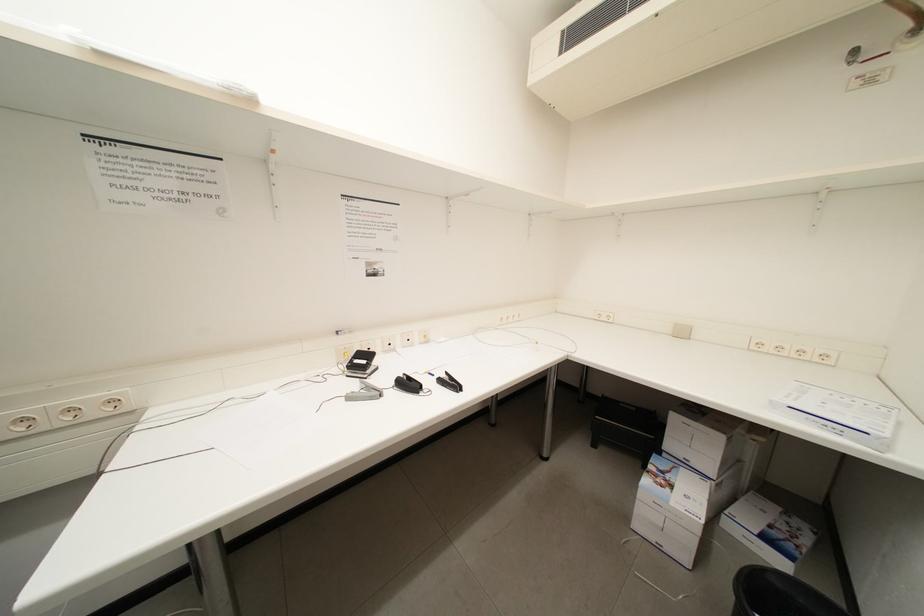
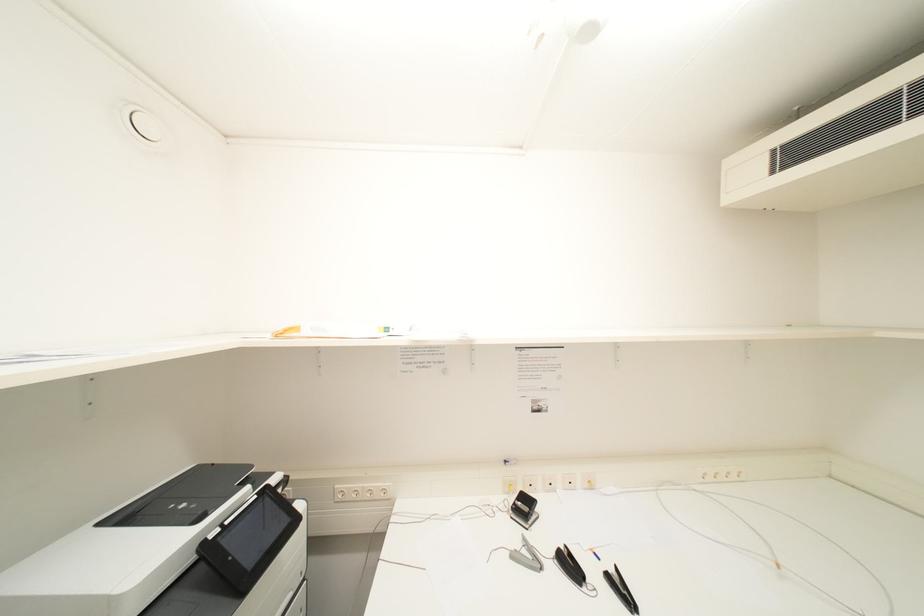
Question: Based on the continuous images, in which direction is the camera rotating? Reply with the corresponding letter.

Choices:
 (A) Left
 (B) Right
 (C) Up
 (D) Down

Answer: (A)